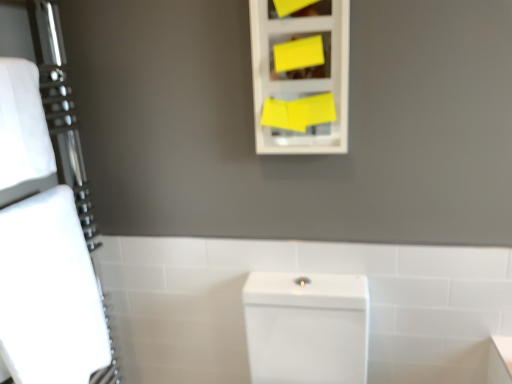
What is the approximate height of yellow matte cabinet at upper center?

The height of yellow matte cabinet at upper center is 17.14 inches.

Describe the element at coordinates (303, 271) in the screenshot. I see `white glossy toilet at center` at that location.

Identify the location of white matte bath towel at left, acting as the second bath towel starting from the bottom. (22, 125).

The height and width of the screenshot is (384, 512). What do you see at coordinates (22, 125) in the screenshot?
I see `white matte bath towel at left, which is the first bath towel in top-to-bottom order` at bounding box center [22, 125].

The height and width of the screenshot is (384, 512). What do you see at coordinates (49, 293) in the screenshot?
I see `white matte bath towel at left, which is counted as the second bath towel, starting from the top` at bounding box center [49, 293].

I want to click on yellow matte cabinet at upper center, so click(x=300, y=78).

Between white glossy porcelain at center and white glossy toilet at center, which one has more height?

With more height is white glossy toilet at center.

From the image's perspective, which is above, white glossy porcelain at center or white glossy toilet at center?

white glossy toilet at center, from the image's perspective.

Could you tell me if white glossy porcelain at center is facing white glossy toilet at center?

No.

Is white glossy porcelain at center at the left side of white glossy toilet at center?

No, white glossy porcelain at center is not to the left of white glossy toilet at center.

Is white glossy toilet at center not near white glossy porcelain at center?

No, white glossy toilet at center is in close proximity to white glossy porcelain at center.

Is white glossy porcelain at center surrounded by white glossy toilet at center?

No, white glossy porcelain at center is not surrounded by white glossy toilet at center.

Is white glossy porcelain at center at the back of white glossy toilet at center?

Yes, white glossy toilet at center is facing away from white glossy porcelain at center.

Where is `porcelain on the right side of white glossy toilet at center`? The width and height of the screenshot is (512, 384). porcelain on the right side of white glossy toilet at center is located at coordinates pyautogui.click(x=306, y=327).

Which is behind, point (106, 348) or point (298, 291)?

The point (106, 348) is more distant.

In the image, is white matte bath towel at left, the first bath towel positioned from the bottom, on the left side or the right side of white glossy porcelain at center?

Based on their positions, white matte bath towel at left, the first bath towel positioned from the bottom, is located to the left of white glossy porcelain at center.

From a real-world perspective, is white matte bath towel at left, the first bath towel positioned from the bottom, physically above white glossy porcelain at center?

Indeed, from a real-world perspective, white matte bath towel at left, the first bath towel positioned from the bottom, stands above white glossy porcelain at center.

Between white matte bath towel at left, the first bath towel positioned from the bottom, and white matte bath towel at left, acting as the second bath towel starting from the bottom, which one has smaller width?

white matte bath towel at left, acting as the second bath towel starting from the bottom, is thinner.

In the scene shown: Is white matte bath towel at left, which is counted as the second bath towel, starting from the top, inside or outside of white matte bath towel at left, acting as the second bath towel starting from the bottom?

The correct answer is: outside.

Is white matte bath towel at left, the first bath towel positioned from the bottom, taller or shorter than white matte bath towel at left, which is the first bath towel in top-to-bottom order?

Clearly, white matte bath towel at left, the first bath towel positioned from the bottom, is taller compared to white matte bath towel at left, which is the first bath towel in top-to-bottom order.

Locate an element on the screen. The width and height of the screenshot is (512, 384). bath towel above the white matte bath towel at left, the first bath towel positioned from the bottom (from a real-world perspective) is located at coordinates (22, 125).

Based on the photo, considering the sizes of white matte bath towel at left, acting as the second bath towel starting from the bottom, and yellow matte cabinet at upper center in the image, is white matte bath towel at left, acting as the second bath towel starting from the bottom, bigger or smaller than yellow matte cabinet at upper center?

Considering their sizes, white matte bath towel at left, acting as the second bath towel starting from the bottom, takes up more space than yellow matte cabinet at upper center.

From the image's perspective, which is below, white matte bath towel at left, which is the first bath towel in top-to-bottom order, or yellow matte cabinet at upper center?

white matte bath towel at left, which is the first bath towel in top-to-bottom order, appears lower in the image.

Could yellow matte cabinet at upper center be considered to be inside white matte bath towel at left, which is the first bath towel in top-to-bottom order?

No, yellow matte cabinet at upper center is not a part of white matte bath towel at left, which is the first bath towel in top-to-bottom order.

In terms of width, does white glossy toilet at center look wider or thinner when compared to white matte bath towel at left, the first bath towel positioned from the bottom?

Clearly, white glossy toilet at center has less width compared to white matte bath towel at left, the first bath towel positioned from the bottom.

From the image's perspective, is white glossy toilet at center on top of white matte bath towel at left, the first bath towel positioned from the bottom?

No, from the image's perspective, white glossy toilet at center is not on top of white matte bath towel at left, the first bath towel positioned from the bottom.

Can you tell me how much white glossy toilet at center and white matte bath towel at left, the first bath towel positioned from the bottom, differ in facing direction?

The angle between the facing direction of white glossy toilet at center and the facing direction of white matte bath towel at left, the first bath towel positioned from the bottom, is 92.8 degrees.

Is white glossy toilet at center positioned beyond the bounds of white matte bath towel at left, which is counted as the second bath towel, starting from the top?

white glossy toilet at center is positioned outside white matte bath towel at left, which is counted as the second bath towel, starting from the top.

In terms of size, does yellow matte cabinet at upper center appear bigger or smaller than white matte bath towel at left, which is counted as the second bath towel, starting from the top?

yellow matte cabinet at upper center is smaller than white matte bath towel at left, which is counted as the second bath towel, starting from the top.

Does yellow matte cabinet at upper center lie in front of white matte bath towel at left, which is counted as the second bath towel, starting from the top?

No, it is not.

Identify the location of medicine cabinet that is behind the white matte bath towel at left, which is counted as the second bath towel, starting from the top. (300, 78).

Between yellow matte cabinet at upper center and white matte bath towel at left, which is counted as the second bath towel, starting from the top, which one has less height?

yellow matte cabinet at upper center is shorter.

Where is `porcelain lying on the right of white glossy toilet at center`? porcelain lying on the right of white glossy toilet at center is located at coordinates (306, 327).

You are a GUI agent. You are given a task and a screenshot of the screen. Output one action in this format:
    pyautogui.click(x=<x>, y=<y>)
    Task: Click on the bath above the white glossy porcelain at center (from a real-world perspective)
    
    Given the screenshot: What is the action you would take?
    pyautogui.click(x=303, y=271)

Estimate the real-world distances between objects in this image. Which object is closer to white matte bath towel at left, which is counted as the second bath towel, starting from the top, white glossy porcelain at center or yellow matte cabinet at upper center?

white glossy porcelain at center is positioned closer to the anchor white matte bath towel at left, which is counted as the second bath towel, starting from the top.

When comparing their distances from white glossy porcelain at center, does white matte bath towel at left, acting as the second bath towel starting from the bottom, or white matte bath towel at left, the first bath towel positioned from the bottom, seem further?

white matte bath towel at left, acting as the second bath towel starting from the bottom, lies further to white glossy porcelain at center than the other object.

When comparing their distances from white glossy porcelain at center, does white matte bath towel at left, which is counted as the second bath towel, starting from the top, or white matte bath towel at left, which is the first bath towel in top-to-bottom order, seem closer?

Based on the image, white matte bath towel at left, which is counted as the second bath towel, starting from the top, appears to be nearer to white glossy porcelain at center.

Considering their positions, is white glossy porcelain at center positioned closer to white glossy toilet at center than white matte bath towel at left, which is the first bath towel in top-to-bottom order?

The object closer to white glossy toilet at center is white glossy porcelain at center.

When comparing their distances from white matte bath towel at left, the first bath towel positioned from the bottom, does yellow matte cabinet at upper center or white matte bath towel at left, which is the first bath towel in top-to-bottom order, seem closer?

Among the two, white matte bath towel at left, which is the first bath towel in top-to-bottom order, is located nearer to white matte bath towel at left, the first bath towel positioned from the bottom.

Considering their positions, is white glossy porcelain at center positioned further to yellow matte cabinet at upper center than white matte bath towel at left, the first bath towel positioned from the bottom?

white matte bath towel at left, the first bath towel positioned from the bottom.

When comparing their distances from white matte bath towel at left, acting as the second bath towel starting from the bottom, does white glossy toilet at center or white glossy porcelain at center seem closer?

white glossy toilet at center.

From the image, which object appears to be nearer to white glossy porcelain at center, yellow matte cabinet at upper center or white matte bath towel at left, which is the first bath towel in top-to-bottom order?

yellow matte cabinet at upper center is positioned closer to the anchor white glossy porcelain at center.

You are a GUI agent. You are given a task and a screenshot of the screen. Output one action in this format:
    pyautogui.click(x=<x>, y=<y>)
    Task: Click on the bath located between white matte bath towel at left, which is counted as the second bath towel, starting from the top, and white glossy porcelain at center in the left-right direction
    Image resolution: width=512 pixels, height=384 pixels.
    Given the screenshot: What is the action you would take?
    pyautogui.click(x=303, y=271)

At what (x,y) coordinates should I click in order to perform the action: click on bath towel between white matte bath towel at left, which is the first bath towel in top-to-bottom order, and white glossy toilet at center. Please return your answer as a coordinate pair (x, y). Looking at the image, I should click on (49, 293).

Locate an element on the screen. bath towel between white matte bath towel at left, acting as the second bath towel starting from the bottom, and yellow matte cabinet at upper center, in the horizontal direction is located at coordinates (49, 293).

Locate an element on the screen. The image size is (512, 384). bath between white matte bath towel at left, which is the first bath towel in top-to-bottom order, and white glossy porcelain at center from left to right is located at coordinates (303, 271).